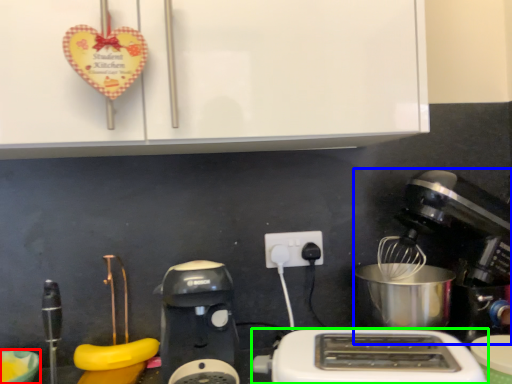
Question: Which object is positioned farthest from bowl (highlighted by a red box)? Select from mixer (highlighted by a blue box) and toaster (highlighted by a green box).

Choices:
 (A) mixer
 (B) toaster

Answer: (A)